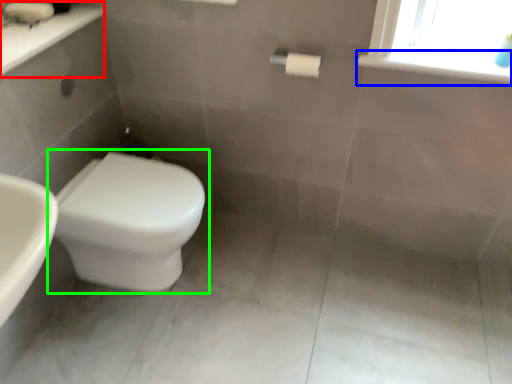
Question: Which object is the closest to the counter top (highlighted by a red box)? Choose among these: window sill (highlighted by a blue box) or toilet (highlighted by a green box).

Choices:
 (A) window sill
 (B) toilet

Answer: (B)